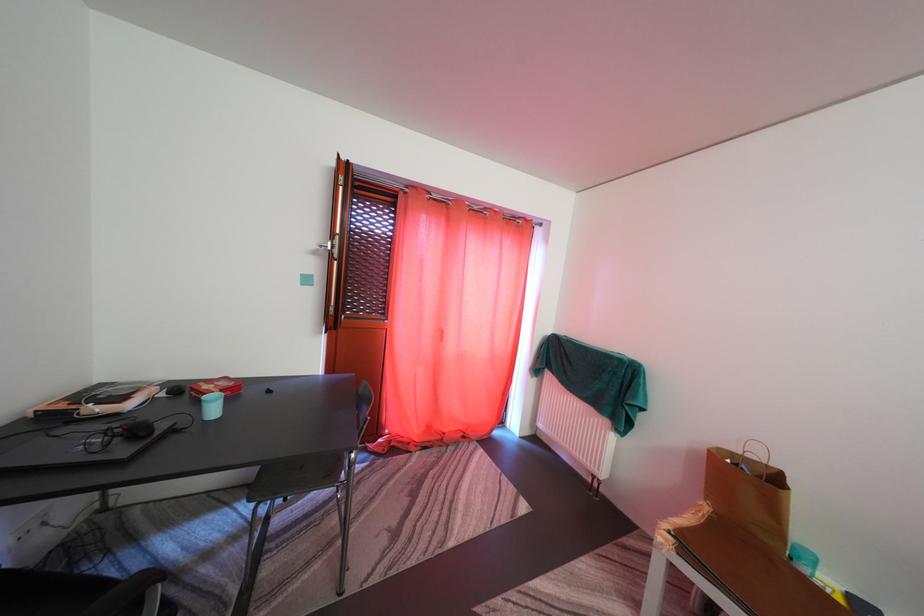
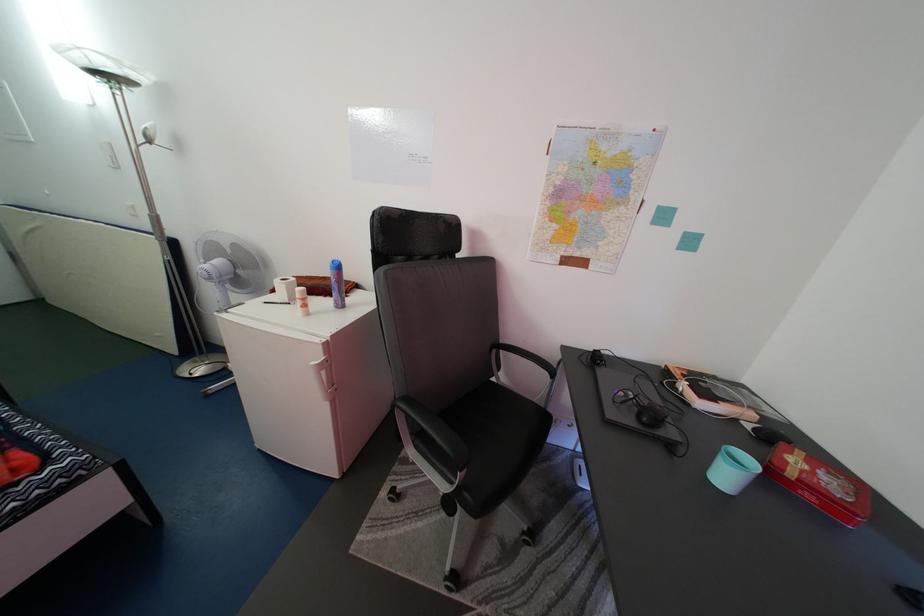
Find the pixel in the second image that matches (x=223, y=418) in the first image.

(735, 484)